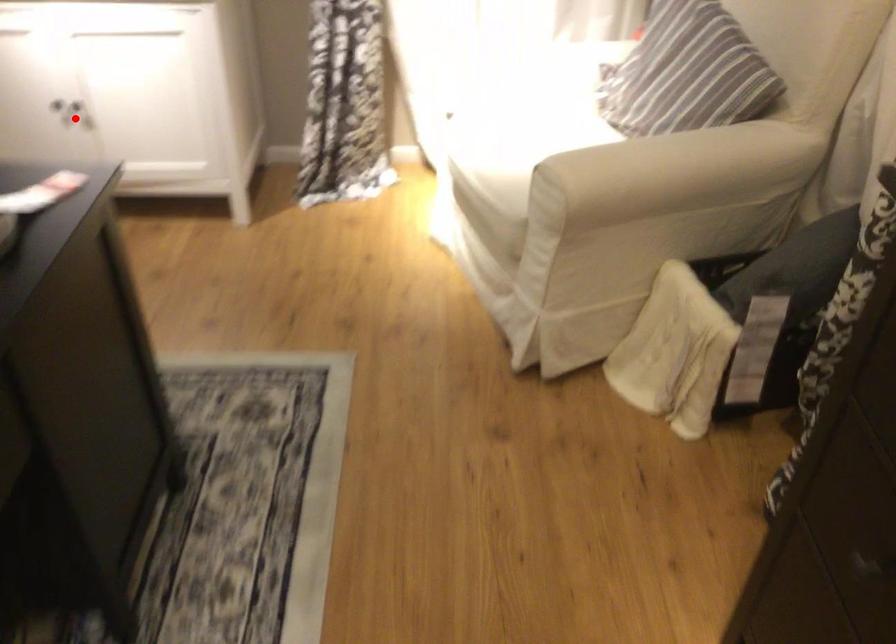
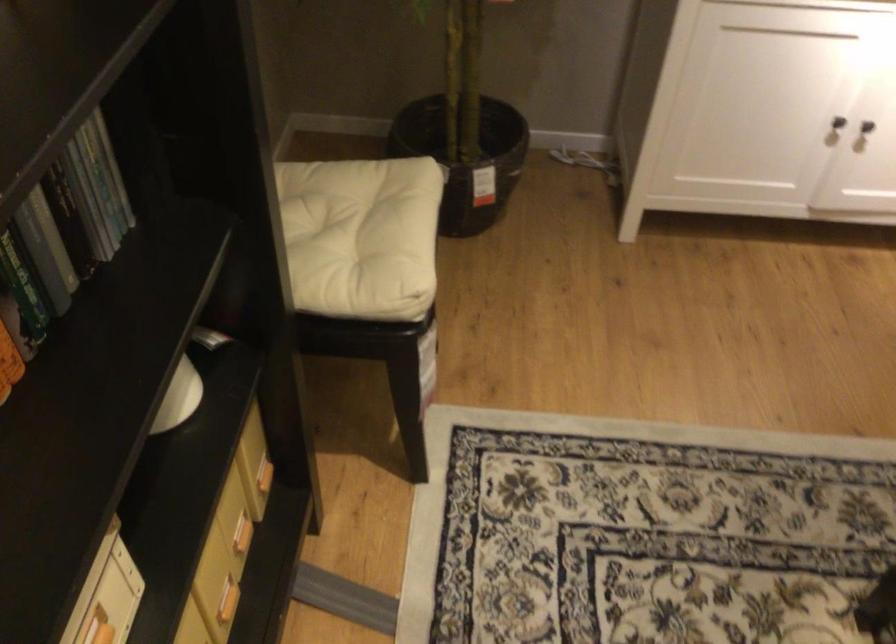
Find the pixel in the second image that matches the highlighted location in the first image.

(866, 126)